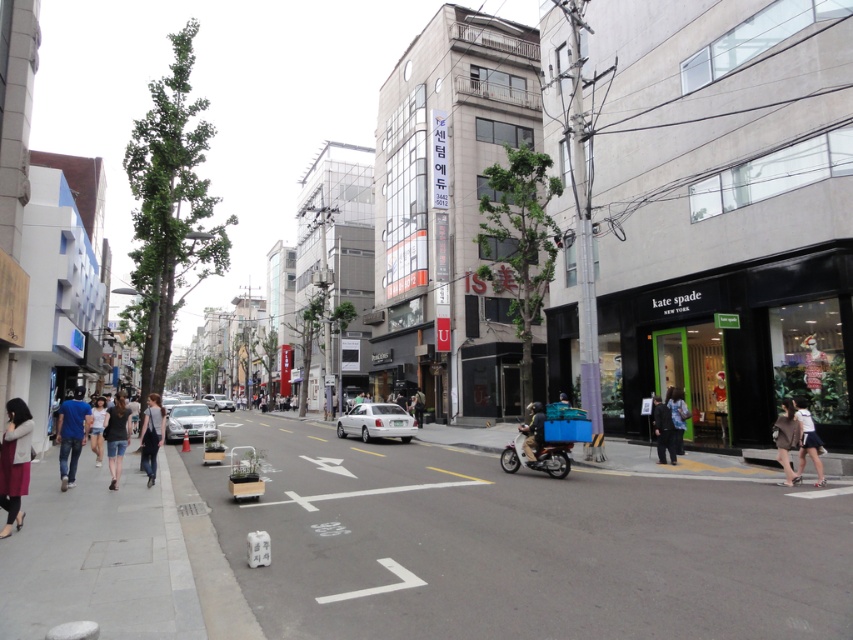
You are a delivery rider who just arrived at the Kate Spade store on the right side of the street. You need to park your silver metallic car at center and place your dark gray helmet at center on the ground. According to the scene, where should you place the dark gray helmet relative to the silver metallic car?

The dark gray helmet at center should be placed on the right side of the silver metallic car at center as per the description.

You are a delivery rider who just arrived at the street. You need to place your dark gray helmet at center and silver metallic car at center in your storage room. Which one should you place first if you want to maximize the storage space efficiently?

The dark gray helmet at center is smaller than the silver metallic car at center, so you should place the silver metallic car at center first to utilize the space effectively before placing the smaller helmet.

You are a delivery person who needs to place a package between the light brown leather jacket at lower right and the dark gray fabric jacket at center. The package requires 2 meters of space. Is there enough space between them?

The light brown leather jacket at lower right and dark gray fabric jacket at center are 21.97 meters apart from each other, so yes, there is more than enough space to place the package between them since 21.97 meters is greater than 2 meters.